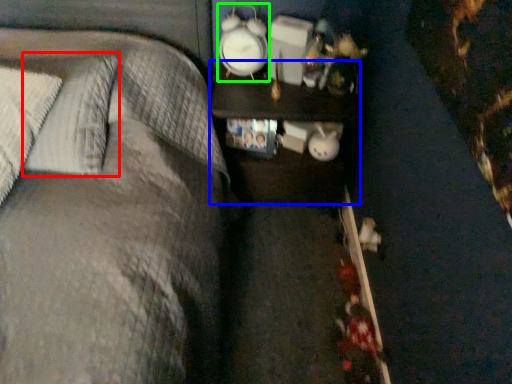
Question: Estimate the real-world distances between objects in this image. Which object is closer to pillow (highlighted by a red box), nightstand (highlighted by a blue box) or clock (highlighted by a green box)?

Choices:
 (A) nightstand
 (B) clock

Answer: (A)